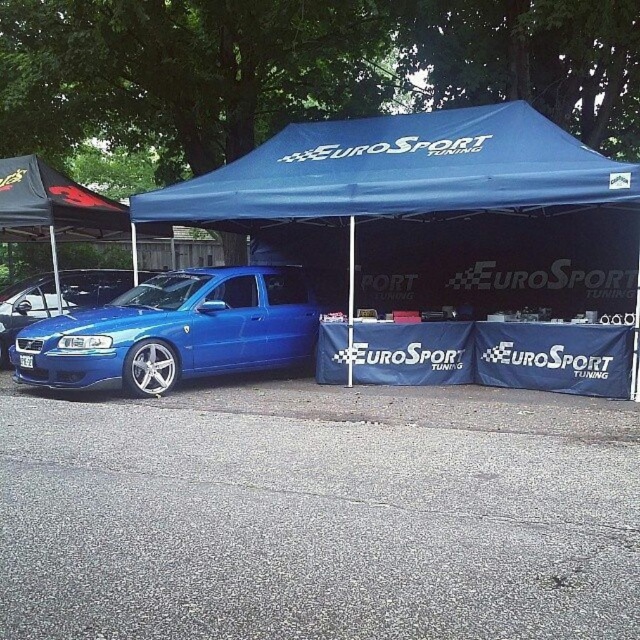
You are a photographer at an automotive event. You need to capture a photo of the matte blue car at center and the matte blue car at left. Based on their positions, which car is positioned lower in the image?

The matte blue car at center is positioned lower than the matte blue car at left in the image.

You are standing in front of the blue fabric tent at center and want to take a photo of the matte blue car at center. Since the tent is in the way, can you move around it to get a clear shot without any obstruction?

The blue fabric tent at center is closer to the viewer than the matte blue car at center, so you can move to the side of the tent to get an unobstructed view of the matte blue car at center.